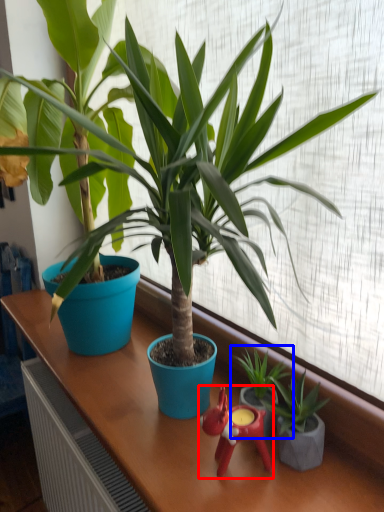
Question: Which of the following is the closest to the observer, miniature (highlighted by a red box) or houseplant (highlighted by a blue box)?

Choices:
 (A) miniature
 (B) houseplant

Answer: (A)